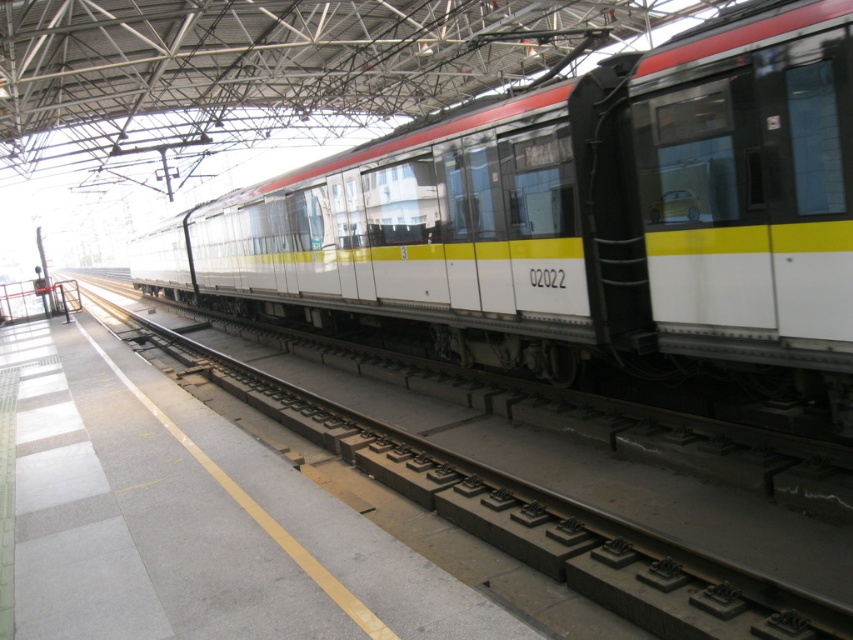
You are a passenger standing on the platform and want to board the white glossy train at center. The track is the white glossy track at center. Can you step directly onto the train from the platform without needing to climb a ladder?

The white glossy train at center is located above the white glossy track at center, so you will need to climb a ladder or use a step to board the train since it is elevated above the track level.

You are a passenger waiting on the platform and need to board the white glossy train at center. The track is the white glossy track at center. Can you tell me which one is larger in size between the train and the track?

The white glossy train at center is bigger than the white glossy track at center, so the train is larger in size than the track.

You are standing at the entrance of the train station platform and want to board the white glossy train at center. Based on the coordinates provided, can you determine if the train is positioned closer to the front or the back of the platform?

The white glossy train at center is positioned at coordinates point (579, 220), which indicates it is closer to the front of the platform.